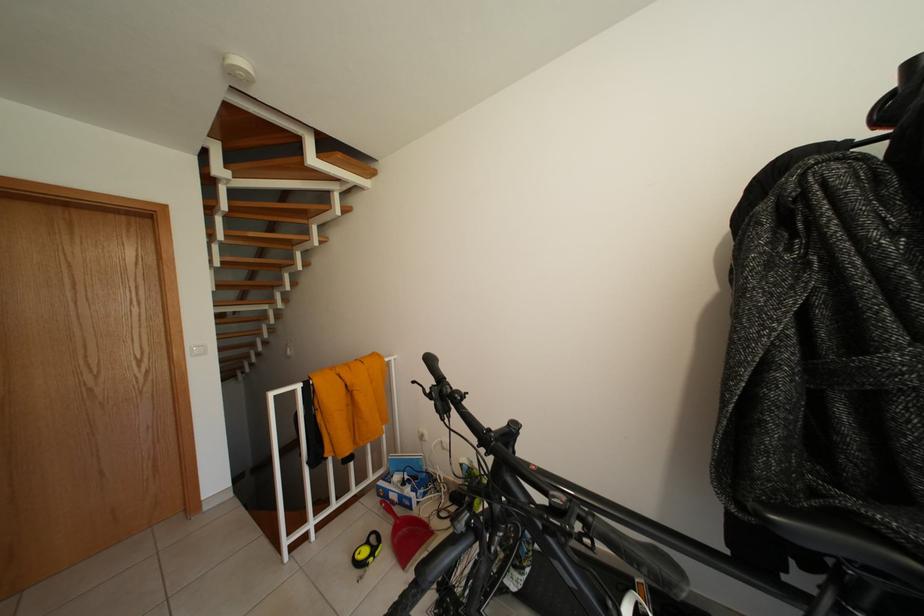
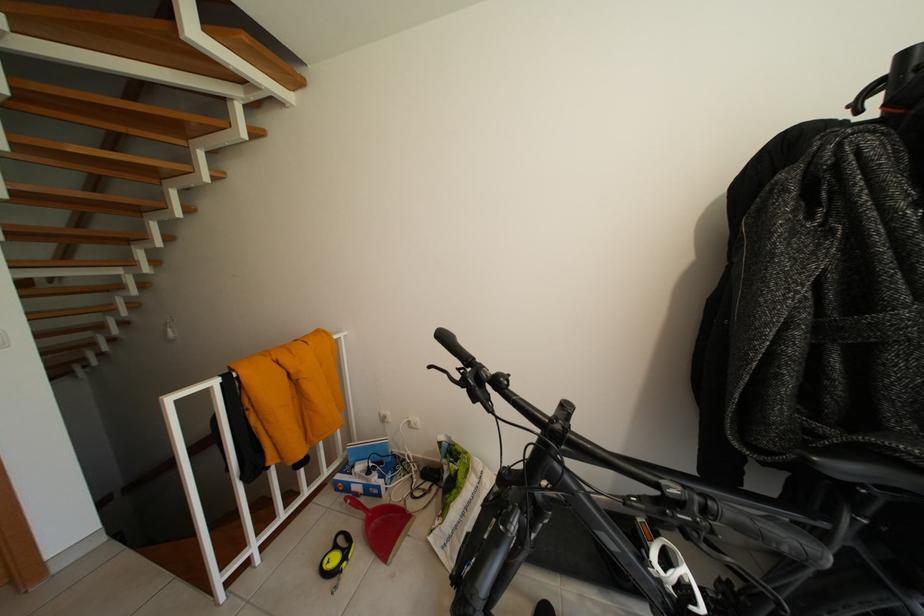
The point at (381, 544) is marked in the first image. Where is the corresponding point in the second image?

(348, 545)